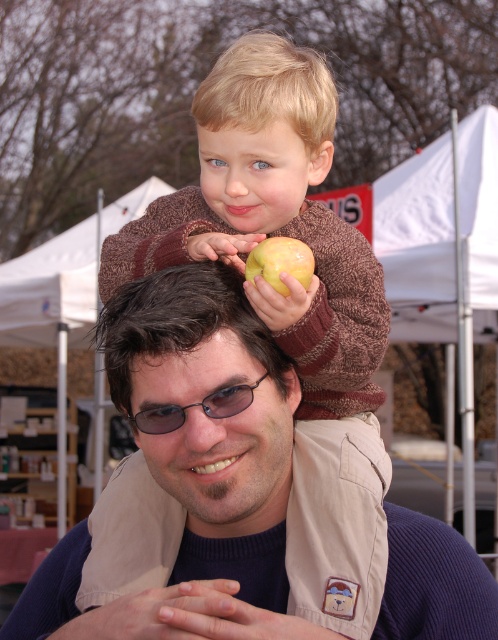
Question: Does brown knitted sweater at upper center have a greater width compared to sunglasses at center?

Choices:
 (A) no
 (B) yes

Answer: (B)

Question: Which point appears farthest from the camera in this image?

Choices:
 (A) (144, 349)
 (B) (172, 410)
 (C) (299, 262)

Answer: (C)

Question: Does brown hair at center lie behind yellow matte apple at upper center?

Choices:
 (A) yes
 (B) no

Answer: (B)

Question: Which object is farther from the camera taking this photo?

Choices:
 (A) brown hair at center
 (B) sunglasses at center
 (C) yellow matte apple at upper center

Answer: (C)

Question: Based on their relative distances, which object is nearer to the matte brown vest at center?

Choices:
 (A) blonde hair at upper center
 (B) brown knitted sweater at upper center
 (C) brown hair at center

Answer: (C)

Question: Where is blonde hair at upper center located in relation to yellow matte apple at upper center in the image?

Choices:
 (A) left
 (B) right

Answer: (A)